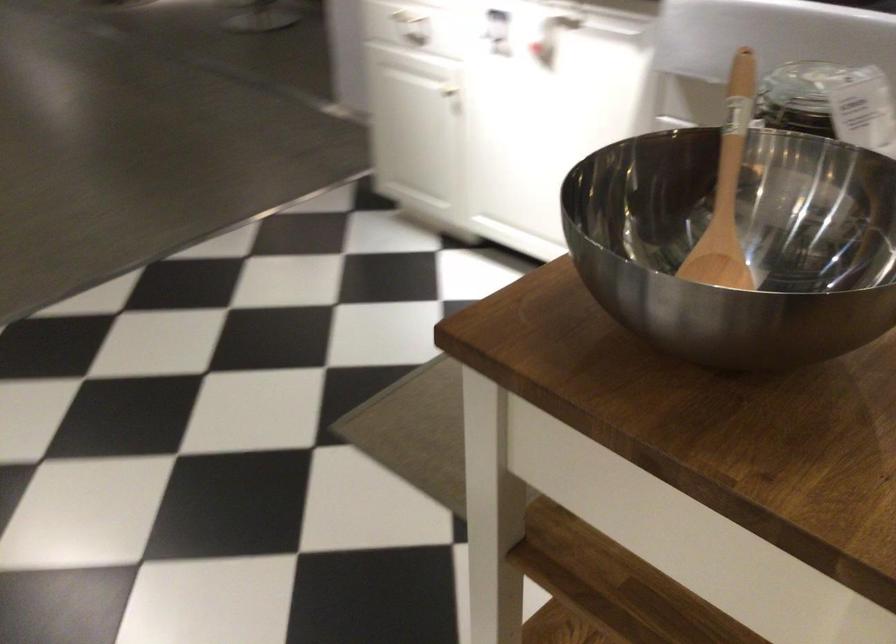
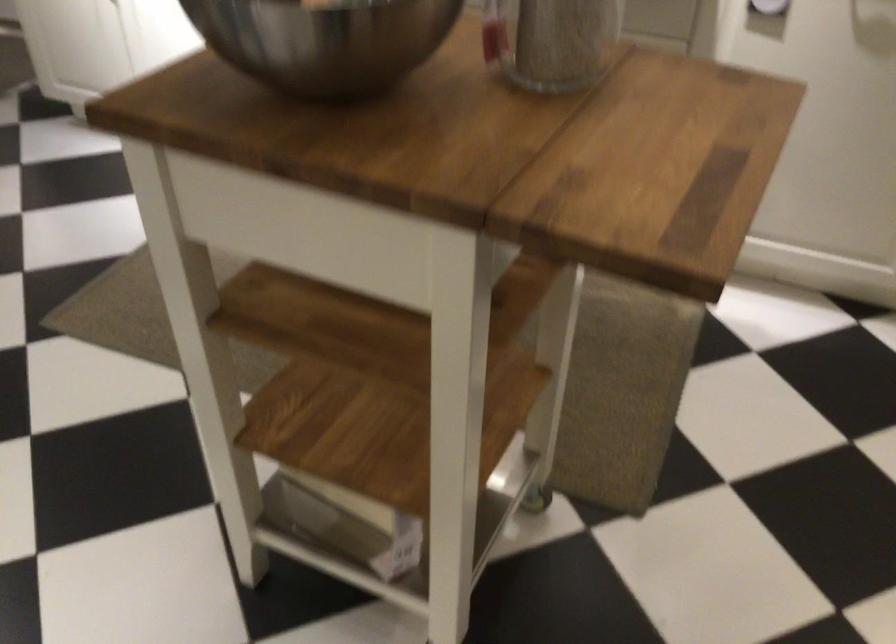
Where in the second image is the point corresponding to [737,327] from the first image?

(323, 41)